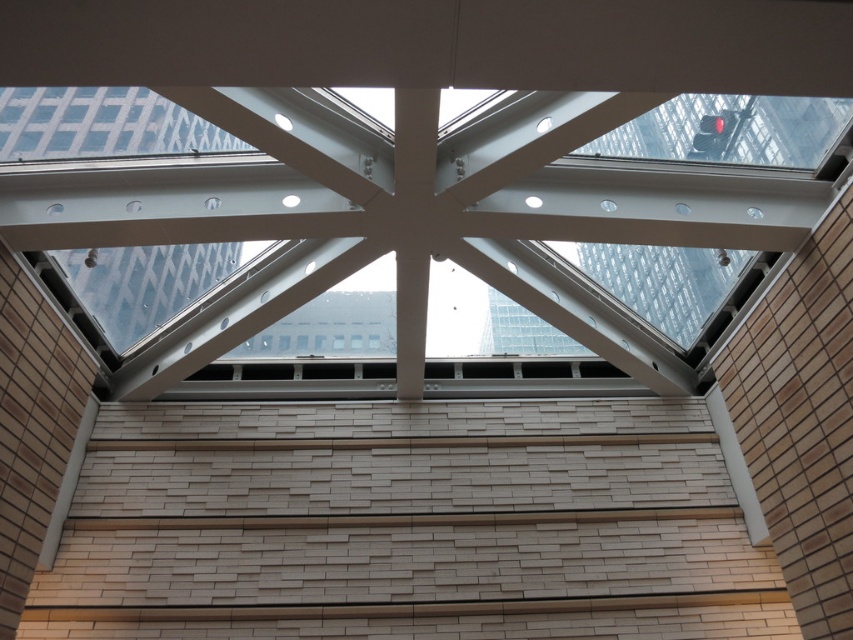
Can you confirm if white glass window at center is taller than transparent glass window at upper left?

Yes.

The image size is (853, 640). What do you see at coordinates (410, 212) in the screenshot?
I see `white glass window at center` at bounding box center [410, 212].

Image resolution: width=853 pixels, height=640 pixels. I want to click on white glass window at center, so click(x=410, y=212).